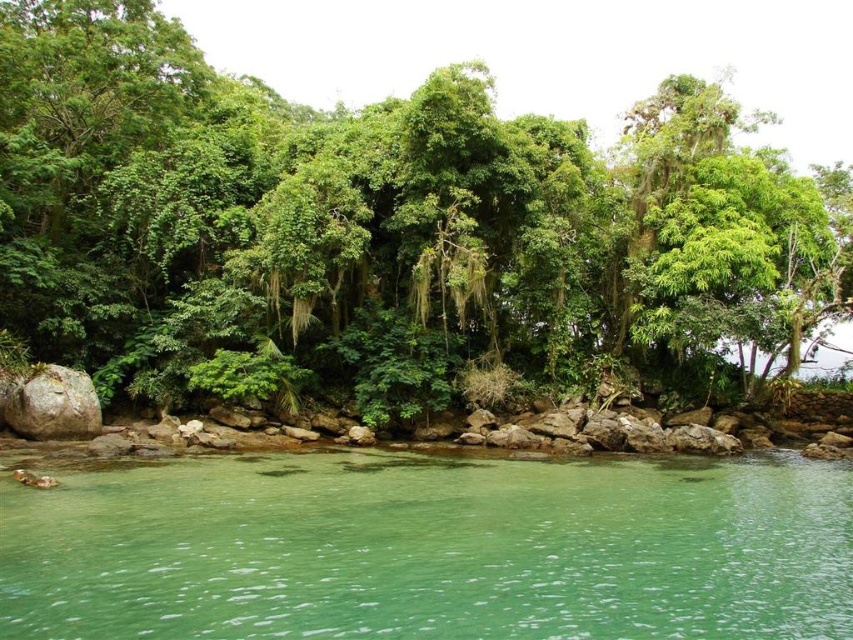
Question: Is green leafy tree at center smaller than green translucent water at lower center?

Choices:
 (A) yes
 (B) no

Answer: (B)

Question: Which point is closer to the camera taking this photo?

Choices:
 (A) (492, 321)
 (B) (24, 625)

Answer: (B)

Question: Can you confirm if green leafy tree at center is smaller than green translucent water at lower center?

Choices:
 (A) no
 (B) yes

Answer: (A)

Question: From the image, what is the correct spatial relationship of green leafy tree at center in relation to green translucent water at lower center?

Choices:
 (A) below
 (B) above

Answer: (B)